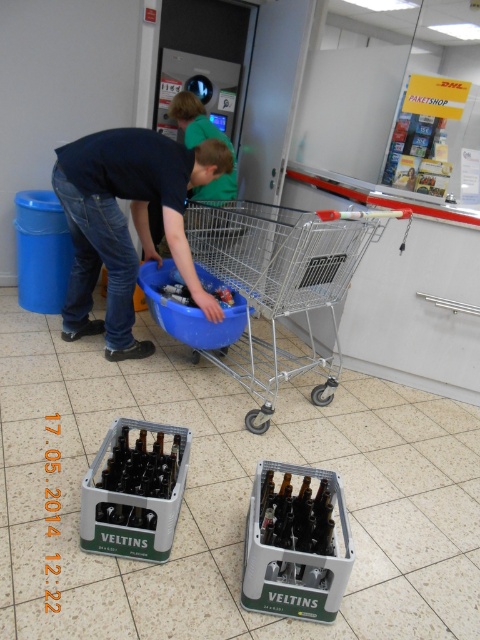
You are trying to fit a large box into the space between the silver metallic shopping cart at center and the dark blue jeans at lower left. Based on their sizes, do you think the box will fit?

The silver metallic shopping cart at center is wider than the dark blue jeans at lower left, so the space between them might be sufficient to fit the large box if the box is narrower than the cart but wider than the jeans. However, without knowing the exact dimensions of the box, it is difficult to determine for sure.

You are standing in the store and need to place a large box on top of the silver metallic shopping cart at center. Considering the height of the dark blue jeans at lower left, do you think the cart is tall enough to support the box without it falling off?

The silver metallic shopping cart at center is much taller than the dark blue jeans at lower left, so it should be tall enough to support the box without it falling off.

From the picture: You are trying to place a large box between the silver metallic shopping cart at center and the dark blue jeans at lower left. What is the minimum distance you need to maintain between them to fit the box?

The silver metallic shopping cart at center and dark blue jeans at lower left are 18.54 inches apart. To fit the box, the minimum distance needed is at least 18.54 inches.